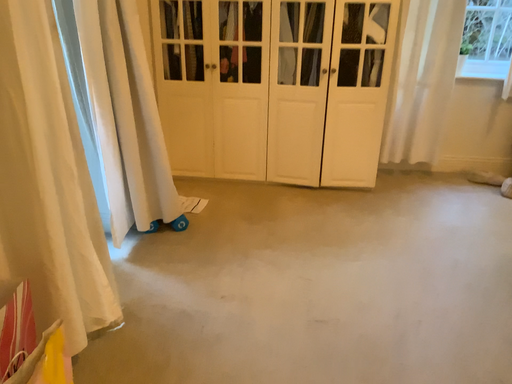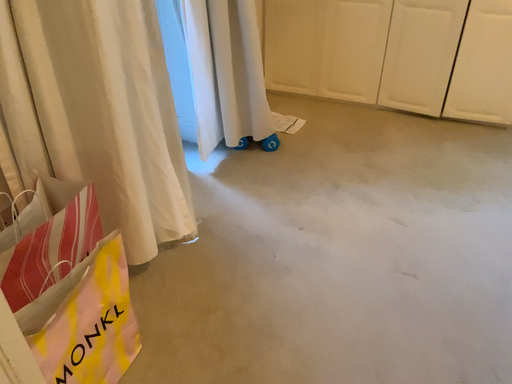
Question: Which way did the camera rotate in the video?

Choices:
 (A) rotated downward
 (B) rotated upward

Answer: (A)